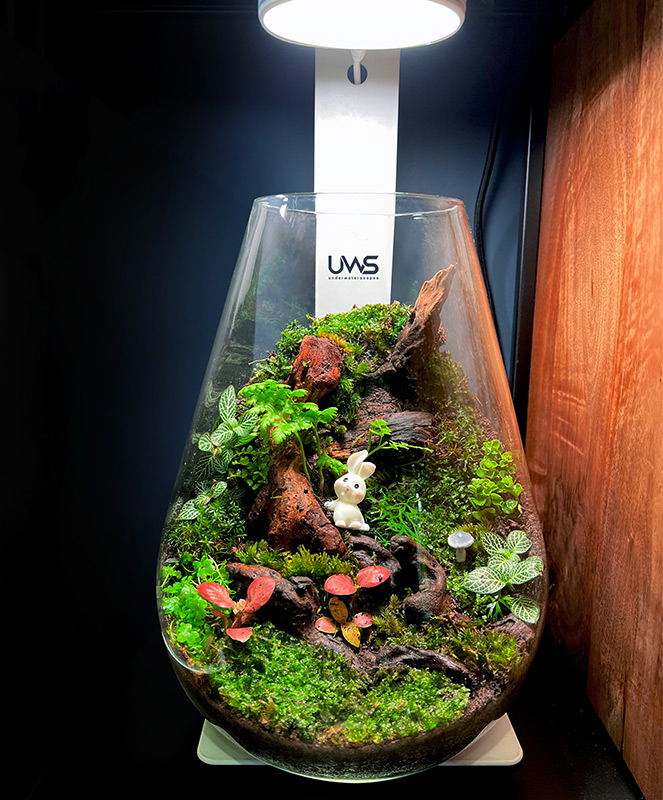
This screenshot has height=800, width=663. In order to click on glass in this screenshot , I will do coord(284,266).